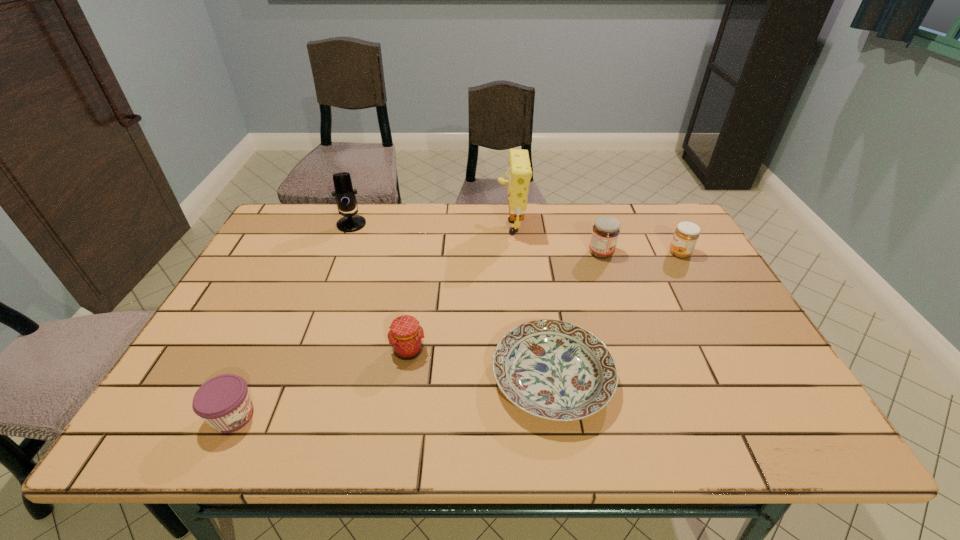
Locate an element on the screen. The width and height of the screenshot is (960, 540). vacant space located on the face of the tallest object is located at coordinates (435, 224).

Where is `free space located on the stand of the microphone`? free space located on the stand of the microphone is located at coordinates (330, 278).

The width and height of the screenshot is (960, 540). Find the location of `vacant space positioned 0.260m on the left of the sixth object from left to right`. vacant space positioned 0.260m on the left of the sixth object from left to right is located at coordinates (501, 253).

You are a GUI agent. You are given a task and a screenshot of the screen. Output one action in this format:
    pyautogui.click(x=<x>, y=<y>)
    Task: Click on the vacant space located on the front label of the rightmost jam
    
    Given the screenshot: What is the action you would take?
    pyautogui.click(x=638, y=253)

Locate an element on the screen. free space located on the front label of the rightmost jam is located at coordinates (636, 253).

The image size is (960, 540). I want to click on free space located on the front label of the rightmost jam, so click(x=625, y=253).

Identify the location of vacant space located on the right of the fifth object from right to left. The height and width of the screenshot is (540, 960). (559, 350).

I want to click on free region located on the front label of the nearest jam, so click(x=418, y=416).

The image size is (960, 540). In order to click on free space located on the back of the shortest object in this screenshot , I will do `click(533, 245)`.

Where is `sponge that is at the far edge`? The image size is (960, 540). sponge that is at the far edge is located at coordinates (519, 173).